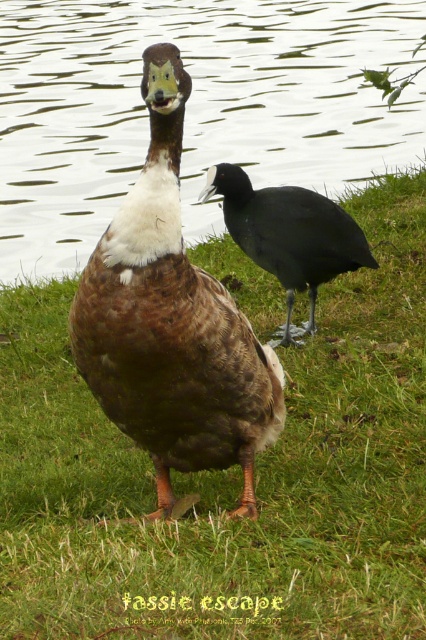
Is point (169, 394) positioned behind point (278, 266)?

No, it is not.

Between brown matte duck at center and shiny black bird at center, which one appears on the right side from the viewer's perspective?

Positioned to the right is shiny black bird at center.

Which is in front, point (255, 509) or point (230, 179)?

Positioned in front is point (255, 509).

The width and height of the screenshot is (426, 640). What are the coordinates of `brown matte duck at center` in the screenshot? It's located at (172, 323).

Is point (278, 58) positioned in front of point (264, 417)?

No, (278, 58) is behind (264, 417).

The image size is (426, 640). Find the location of `glossy water at center`. glossy water at center is located at coordinates (190, 108).

Which of these two, glossy water at center or shiny black bird at center, stands shorter?

With less height is glossy water at center.

Who is higher up, glossy water at center or shiny black bird at center?

glossy water at center is above.

Is point (307, 138) positioned before point (227, 195)?

No.

The width and height of the screenshot is (426, 640). Find the location of `glossy water at center`. glossy water at center is located at coordinates (190, 108).